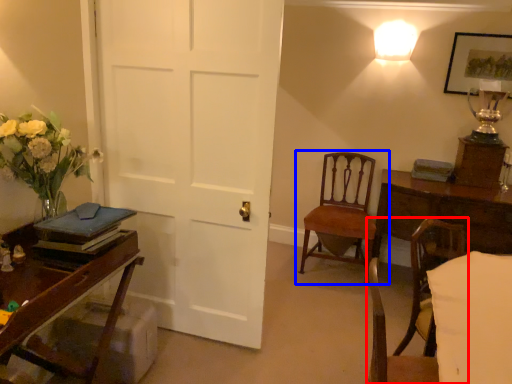
Question: Which of the following is the farthest to the observer, chair (highlighted by a red box) or chair (highlighted by a blue box)?

Choices:
 (A) chair
 (B) chair

Answer: (B)